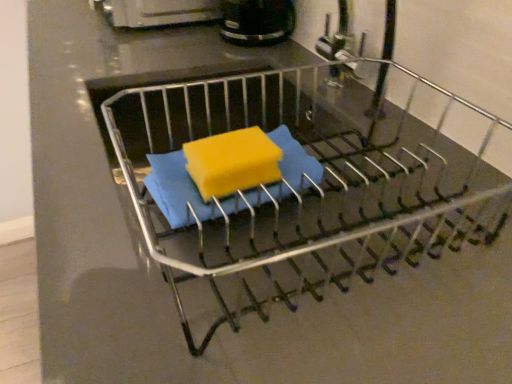
The width and height of the screenshot is (512, 384). Identify the location of black plastic coffee maker at upper center. (257, 21).

Measure the distance between metallic dish rack at center and camera.

A distance of 11.69 inches exists between metallic dish rack at center and camera.

Where is `yellow sponge at center`? The height and width of the screenshot is (384, 512). yellow sponge at center is located at coordinates (232, 162).

Is black plastic coffee maker at upper center directly adjacent to yellow sponge at center?

No, black plastic coffee maker at upper center is not making contact with yellow sponge at center.

You are a GUI agent. You are given a task and a screenshot of the screen. Output one action in this format:
    pyautogui.click(x=<x>, y=<y>)
    Task: Click on the appliance positioned vertically above the yellow sponge at center (from a real-world perspective)
    The image size is (512, 384).
    Given the screenshot: What is the action you would take?
    pyautogui.click(x=257, y=21)

Relative to yellow sponge at center, is black plastic coffee maker at upper center in front or behind?

black plastic coffee maker at upper center is positioned farther from the viewer than yellow sponge at center.

Is black plastic coffee maker at upper center oriented towards metallic dish rack at center?

No, black plastic coffee maker at upper center is not facing towards metallic dish rack at center.

In the scene shown: Is black plastic coffee maker at upper center taller or shorter than metallic dish rack at center?

In the image, black plastic coffee maker at upper center appears to be taller than metallic dish rack at center.

Considering the positions of point (266, 24) and point (277, 184), is point (266, 24) closer or farther from the camera than point (277, 184)?

Point (266, 24).

I want to click on appliance above the metallic dish rack at center (from a real-world perspective), so (257, 21).

Is point (249, 160) farther from camera compared to point (221, 239)?

No, it is in front of (221, 239).

Which of these two, yellow sponge at center or metallic dish rack at center, stands shorter?

Standing shorter between the two is yellow sponge at center.

From a real-world perspective, is yellow sponge at center on top of metallic dish rack at center?

Yes.

You are a GUI agent. You are given a task and a screenshot of the screen. Output one action in this format:
    pyautogui.click(x=<x>, y=<y>)
    Task: Click on the appliance to the right of yellow sponge at center
    
    Given the screenshot: What is the action you would take?
    pyautogui.click(x=257, y=21)

Based on the photo, how different are the orientations of yellow sponge at center and black plastic coffee maker at upper center in degrees?

The facing directions of yellow sponge at center and black plastic coffee maker at upper center are 1.33 degrees apart.

Considering the sizes of objects yellow sponge at center and black plastic coffee maker at upper center in the image provided, who is smaller, yellow sponge at center or black plastic coffee maker at upper center?

With smaller size is yellow sponge at center.

Looking at this image, from the image's perspective, who appears lower, yellow sponge at center or black plastic coffee maker at upper center?

yellow sponge at center.

Can you confirm if metallic dish rack at center is positioned to the left of yellow sponge at center?

In fact, metallic dish rack at center is to the right of yellow sponge at center.

Considering the positions of objects metallic dish rack at center and yellow sponge at center in the image provided, who is in front, metallic dish rack at center or yellow sponge at center?

metallic dish rack at center.

Does metallic dish rack at center have a lesser height compared to yellow sponge at center?

Incorrect, the height of metallic dish rack at center does not fall short of that of yellow sponge at center.

Which object is thinner, metallic dish rack at center or yellow sponge at center?

yellow sponge at center.

Is metallic dish rack at center located outside black plastic coffee maker at upper center?

Yes, metallic dish rack at center is not within black plastic coffee maker at upper center.

Measure the distance between metallic dish rack at center and black plastic coffee maker at upper center.

16.07 inches.

Who is taller, metallic dish rack at center or black plastic coffee maker at upper center?

Standing taller between the two is black plastic coffee maker at upper center.

From the picture: Considering their positions, is metallic dish rack at center located in front of or behind black plastic coffee maker at upper center?

Clearly, metallic dish rack at center is in front of black plastic coffee maker at upper center.

This screenshot has width=512, height=384. In order to click on appliance behind the yellow sponge at center in this screenshot , I will do `click(257, 21)`.

This screenshot has height=384, width=512. I want to click on appliance that is above the metallic dish rack at center (from a real-world perspective), so click(257, 21).

Which object lies further to the anchor point metallic dish rack at center, black plastic coffee maker at upper center or yellow sponge at center?

black plastic coffee maker at upper center lies further to metallic dish rack at center than the other object.

When comparing their distances from metallic dish rack at center, does yellow sponge at center or black plastic coffee maker at upper center seem further?

black plastic coffee maker at upper center.

Looking at the image, which one is located further to black plastic coffee maker at upper center, metallic dish rack at center or yellow sponge at center?

yellow sponge at center lies further to black plastic coffee maker at upper center than the other object.

Estimate the real-world distances between objects in this image. Which object is closer to yellow sponge at center, metallic dish rack at center or black plastic coffee maker at upper center?

metallic dish rack at center is positioned closer to the anchor yellow sponge at center.

Which object lies further to the anchor point yellow sponge at center, black plastic coffee maker at upper center or metallic dish rack at center?

black plastic coffee maker at upper center lies further to yellow sponge at center than the other object.

Which object lies further to the anchor point black plastic coffee maker at upper center, yellow sponge at center or metallic dish rack at center?

The object further to black plastic coffee maker at upper center is yellow sponge at center.

Image resolution: width=512 pixels, height=384 pixels. In order to click on cheese between metallic dish rack at center and black plastic coffee maker at upper center along the z-axis in this screenshot , I will do `click(232, 162)`.